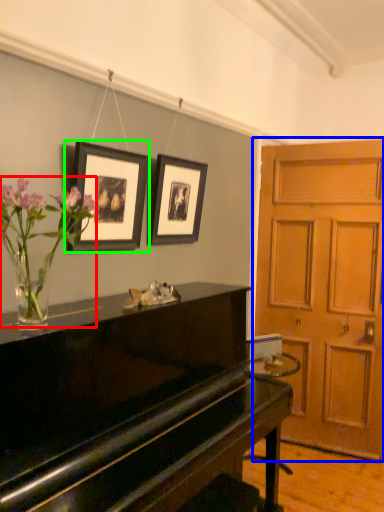
Question: Estimate the real-world distances between objects in this image. Which object is farther from floral arrangement (highlighted by a red box), door (highlighted by a blue box) or picture frame (highlighted by a green box)?

Choices:
 (A) door
 (B) picture frame

Answer: (A)